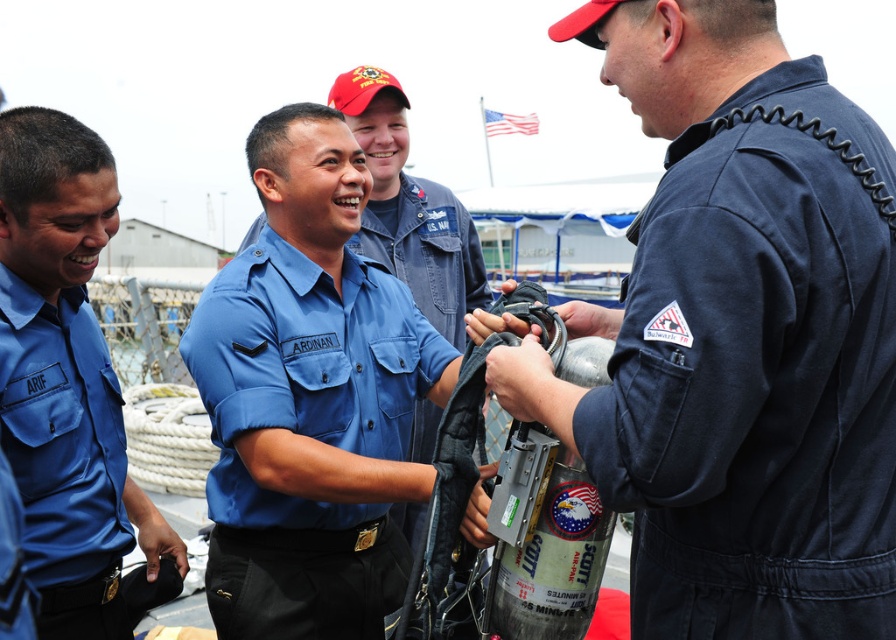
You are a photographer positioned at the back of the scene. You want to take a photo of both the navy blue fabric jumpsuit at right and the matte blue shirt at center without any obstruction. Which object should you adjust to ensure the other is fully visible?

The navy blue fabric jumpsuit at right is in front of the matte blue shirt at center. To ensure the matte blue shirt at center is fully visible, you should adjust the position of the navy blue fabric jumpsuit at right.

You are standing at the position of the viewer in the scene. There is a navy blue fabric jumpsuit at right. Can you reach out and touch it without moving your feet?

The navy blue fabric jumpsuit at right and viewer are 4.55 feet apart from each other, so you cannot reach it without moving your feet since the distance is greater than an average person can reach.